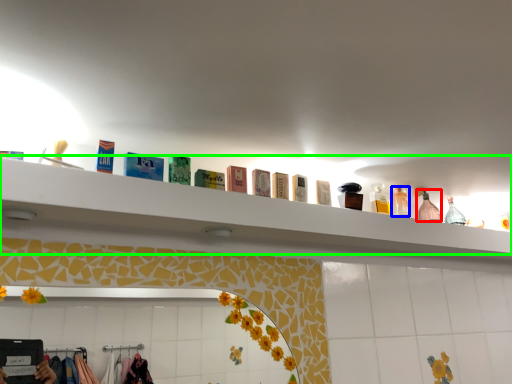
Question: Estimate the real-world distances between objects in this image. Which object is closer to bottle (highlighted by a red box), toiletry (highlighted by a blue box) or shelf (highlighted by a green box)?

Choices:
 (A) toiletry
 (B) shelf

Answer: (A)